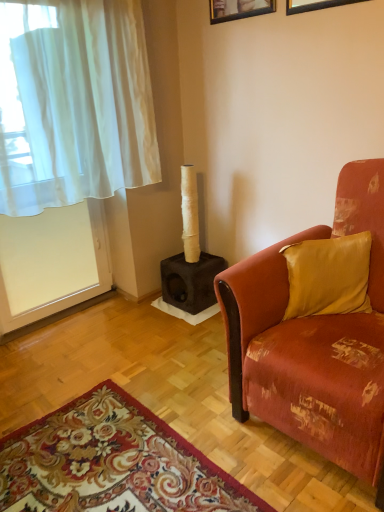
Question: Based on their positions, is wooden picture frame at upper center, which is the 1th picture frame from back to front, located to the left or right of white sheer curtain at left?

Choices:
 (A) right
 (B) left

Answer: (A)

Question: From the image's perspective, is wooden picture frame at upper center, the second picture frame when ordered from right to left, positioned above or below white sheer curtain at left?

Choices:
 (A) above
 (B) below

Answer: (A)

Question: Which object is the farthest from the velvet orange couch at right?

Choices:
 (A) floral carpet at lower left
 (B) white sheer curtain at left
 (C) black matte picture frame at upper center, placed as the second picture frame when sorted from back to front
 (D) wooden picture frame at upper center, the second picture frame when ordered from right to left
 (E) silky gold pillow at right

Answer: (D)

Question: Which object is positioned farthest from the white sheer curtain at left?

Choices:
 (A) silky gold pillow at right
 (B) floral carpet at lower left
 (C) black matte picture frame at upper center, which is the second picture frame from left to right
 (D) wooden picture frame at upper center, the second picture frame when ordered from right to left
 (E) velvet orange couch at right

Answer: (B)